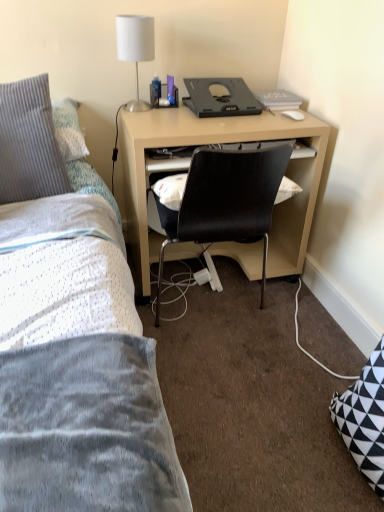
In order to face matte wood computer desk at center, should I rotate leftwards or rightwards?

To face it directly, rotate right by 2.726 degrees.

What do you see at coordinates (29, 143) in the screenshot? I see `gray ribbed pillow at upper left` at bounding box center [29, 143].

What are the coordinates of `gray ribbed pillow at upper left` in the screenshot? It's located at (29, 143).

Locate an element on the screen. The height and width of the screenshot is (512, 384). white fabric lampshade at upper center is located at coordinates (135, 48).

Considering the sizes of objects white fabric lampshade at upper center and black plastic desktop at center in the image provided, who is taller, white fabric lampshade at upper center or black plastic desktop at center?

Standing taller between the two is white fabric lampshade at upper center.

Does white fabric lampshade at upper center appear on the left side of black plastic desktop at center?

Yes, white fabric lampshade at upper center is to the left of black plastic desktop at center.

From the image's perspective, which object appears higher, white fabric lampshade at upper center or black plastic desktop at center?

white fabric lampshade at upper center appears higher in the image.

Which point is more distant from viewer, (123, 47) or (246, 102)?

Point (246, 102)

Considering the positions of objects matte wood computer desk at center and black plastic desktop at center in the image provided, who is in front, matte wood computer desk at center or black plastic desktop at center?

matte wood computer desk at center is closer to the camera.

Based on the photo, in terms of width, does matte wood computer desk at center look wider or thinner when compared to black plastic desktop at center?

matte wood computer desk at center is wider than black plastic desktop at center.

Which of these two, matte wood computer desk at center or black plastic desktop at center, stands shorter?

black plastic desktop at center.

Is matte wood computer desk at center outside of black plastic desktop at center?

matte wood computer desk at center is positioned outside black plastic desktop at center.

Could white fabric lampshade at upper center be considered to be inside gray ribbed pillow at upper left?

No, white fabric lampshade at upper center is not surrounded by gray ribbed pillow at upper left.

Is gray ribbed pillow at upper left taller than white fabric lampshade at upper center?

Yes.

Is gray ribbed pillow at upper left at the left side of white fabric lampshade at upper center?

Yes, gray ribbed pillow at upper left is to the left of white fabric lampshade at upper center.

Where is `pillow that appears in front of the black plastic desktop at center`? This screenshot has width=384, height=512. pillow that appears in front of the black plastic desktop at center is located at coordinates (29, 143).

Is gray ribbed pillow at upper left located within black plastic desktop at center?

No, gray ribbed pillow at upper left is not surrounded by black plastic desktop at center.

From their relative heights in the image, would you say black plastic desktop at center is taller or shorter than gray ribbed pillow at upper left?

In the image, black plastic desktop at center appears to be shorter than gray ribbed pillow at upper left.

Is matte wood computer desk at center directly adjacent to white fabric lampshade at upper center?

No, matte wood computer desk at center is not in contact with white fabric lampshade at upper center.

Between matte wood computer desk at center and white fabric lampshade at upper center, which one has smaller size?

white fabric lampshade at upper center.

You are a GUI agent. You are given a task and a screenshot of the screen. Output one action in this format:
    pyautogui.click(x=<x>, y=<y>)
    Task: Click on the computer desk on the right of the white fabric lampshade at upper center
    The height and width of the screenshot is (512, 384).
    Given the screenshot: What is the action you would take?
    pyautogui.click(x=212, y=143)

Considering their positions, is gray ribbed pillow at upper left located in front of or behind black plastic desktop at center?

gray ribbed pillow at upper left is positioned closer to the viewer than black plastic desktop at center.

Is gray ribbed pillow at upper left in contact with black plastic desktop at center?

They are not placed beside each other.

Considering the positions of objects gray ribbed pillow at upper left and black plastic desktop at center in the image provided, who is more to the right, gray ribbed pillow at upper left or black plastic desktop at center?

black plastic desktop at center.

This screenshot has width=384, height=512. Find the location of `desktop located above the gray ribbed pillow at upper left (from the image's perspective)`. desktop located above the gray ribbed pillow at upper left (from the image's perspective) is located at coordinates (220, 98).

From a real-world perspective, which object rests below the other?

matte wood computer desk at center is physically lower.

Consider the image. How many degrees apart are the facing directions of matte wood computer desk at center and gray ribbed pillow at upper left?

1.11 degrees.

Who is taller, matte wood computer desk at center or gray ribbed pillow at upper left?

matte wood computer desk at center.

Does point (324, 128) come farther from viewer compared to point (25, 155)?

That is True.

Where is `desktop below the white fabric lampshade at upper center (from a real-world perspective)`? This screenshot has width=384, height=512. desktop below the white fabric lampshade at upper center (from a real-world perspective) is located at coordinates (220, 98).

Locate an element on the screen. computer desk that is on the left side of black plastic desktop at center is located at coordinates (212, 143).

Considering their positions, is gray ribbed pillow at upper left positioned further to white fabric lampshade at upper center than matte wood computer desk at center?

Among the two, matte wood computer desk at center is located further to white fabric lampshade at upper center.

From the picture: Which object lies nearer to the anchor point gray ribbed pillow at upper left, black plastic desktop at center or white fabric lampshade at upper center?

Among the two, white fabric lampshade at upper center is located nearer to gray ribbed pillow at upper left.

When comparing their distances from gray ribbed pillow at upper left, does white fabric lampshade at upper center or matte wood computer desk at center seem closer?

white fabric lampshade at upper center.

Based on the photo, considering their positions, is gray ribbed pillow at upper left positioned further to black plastic desktop at center than white fabric lampshade at upper center?

gray ribbed pillow at upper left is further to black plastic desktop at center.

From the image, which object appears to be nearer to gray ribbed pillow at upper left, white fabric lampshade at upper center or black plastic desktop at center?

white fabric lampshade at upper center is closer to gray ribbed pillow at upper left.

From the image, which object appears to be farther from matte wood computer desk at center, gray ribbed pillow at upper left or black plastic desktop at center?

Based on the image, gray ribbed pillow at upper left appears to be further to matte wood computer desk at center.

Looking at the image, which one is located closer to matte wood computer desk at center, black plastic desktop at center or gray ribbed pillow at upper left?

black plastic desktop at center.

Which object lies further to the anchor point black plastic desktop at center, white fabric lampshade at upper center or matte wood computer desk at center?

Among the two, white fabric lampshade at upper center is located further to black plastic desktop at center.

You are a GUI agent. You are given a task and a screenshot of the screen. Output one action in this format:
    pyautogui.click(x=<x>, y=<y>)
    Task: Click on the computer desk located between gray ribbed pillow at upper left and black plastic desktop at center in the left-right direction
    
    Given the screenshot: What is the action you would take?
    pyautogui.click(x=212, y=143)

The image size is (384, 512). In order to click on lamp between gray ribbed pillow at upper left and matte wood computer desk at center in this screenshot , I will do `click(135, 48)`.

I want to click on lamp between gray ribbed pillow at upper left and black plastic desktop at center in the horizontal direction, so click(135, 48).

Locate an element on the screen. The height and width of the screenshot is (512, 384). desktop between white fabric lampshade at upper center and matte wood computer desk at center in the up-down direction is located at coordinates (220, 98).